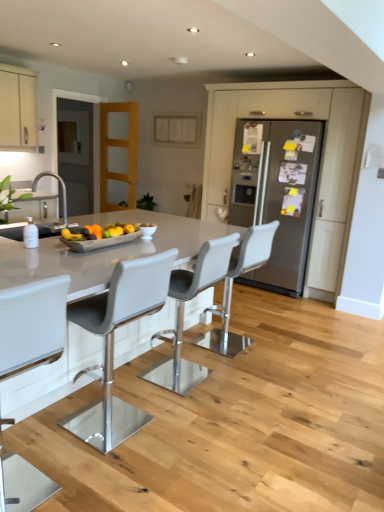
Find the location of `free space in front of white leather bar stool at center, the second chair in the back-to-front sequence`. free space in front of white leather bar stool at center, the second chair in the back-to-front sequence is located at coordinates (x=190, y=411).